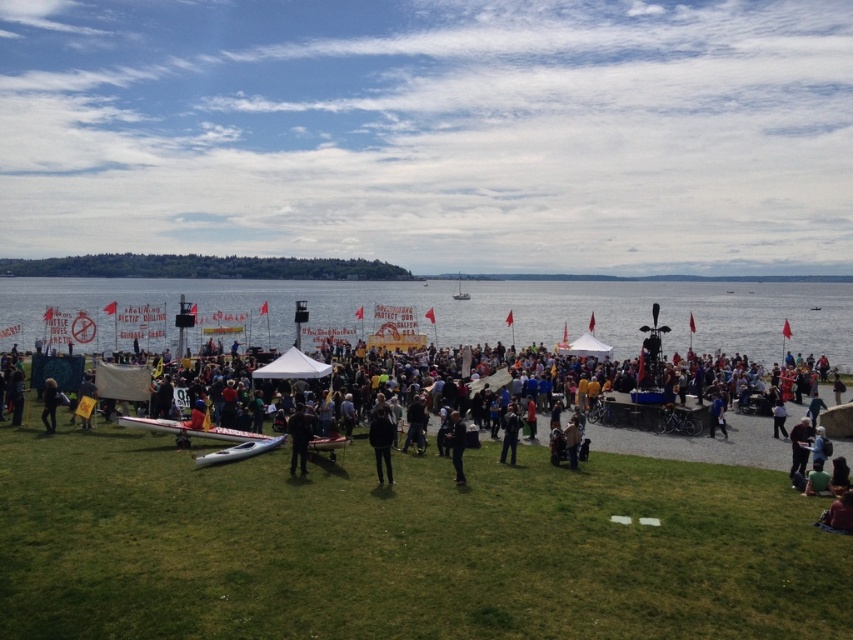
Based on the photo, you are standing at the edge of the waterfront gathering and want to reach the point marked as point (x=192, y=579). Which direction should you walk to get there from the point marked as point (x=289, y=465)?

To reach point (x=192, y=579) from point (x=289, y=465), you should walk towards the direction where the point (x=192, y=579) is closer to the viewer compared to point (x=289, y=465).

You are a photographer trying to capture a shot of the black fabric person at center and the dark blue jeans at lower right. Based on their positions, which one would appear closer to the top of your camera viewfinder?

The black fabric person at center is above the dark blue jeans at lower right, so the black fabric person at center would appear closer to the top of the camera viewfinder.

You are standing at the origin point of the coordinate system. You want to walk to the green grass at lower left. What are the coordinates you need to move to?

The coordinates to move to are approximately 0.855 in the x direction and 0.474 in the y direction.